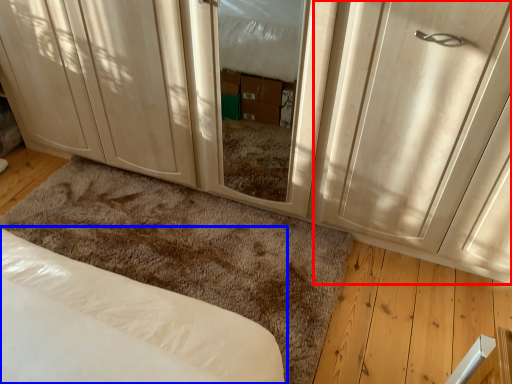
Question: Among these objects, which one is farthest to the camera, door (highlighted by a red box) or bed (highlighted by a blue box)?

Choices:
 (A) door
 (B) bed

Answer: (B)